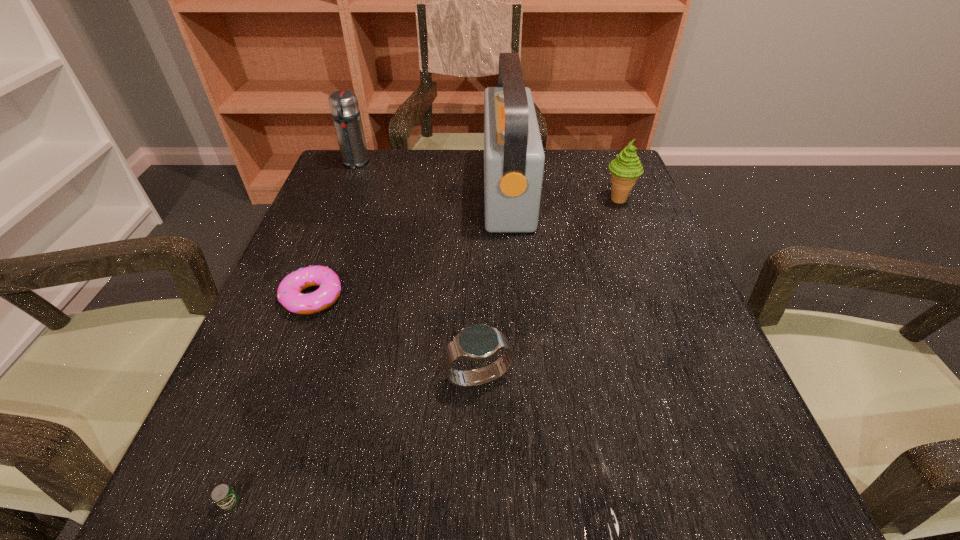
Identify the location of radio receiver. (514, 158).

The width and height of the screenshot is (960, 540). Find the location of `thermos bottle`. thermos bottle is located at coordinates (344, 106).

This screenshot has width=960, height=540. Identify the location of icecream. click(625, 170).

Find the location of a particular element. the rightmost object is located at coordinates (625, 170).

This screenshot has height=540, width=960. Find the location of `the third shortest object`. the third shortest object is located at coordinates (479, 342).

Locate an element on the screen. This screenshot has height=540, width=960. the second nearest object is located at coordinates (479, 342).

This screenshot has height=540, width=960. I want to click on doughnut, so click(x=289, y=294).

Where is `the third nearest object`? This screenshot has width=960, height=540. the third nearest object is located at coordinates (289, 294).

Locate an element on the screen. the nearest object is located at coordinates (222, 495).

Identify the location of beer can. (222, 495).